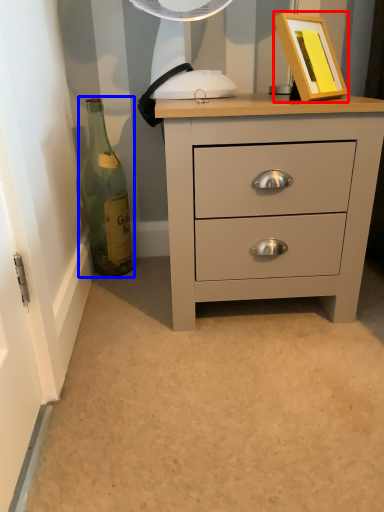
Question: Which object is closer to the camera taking this photo, picture frame (highlighted by a red box) or bottle (highlighted by a blue box)?

Choices:
 (A) picture frame
 (B) bottle

Answer: (A)